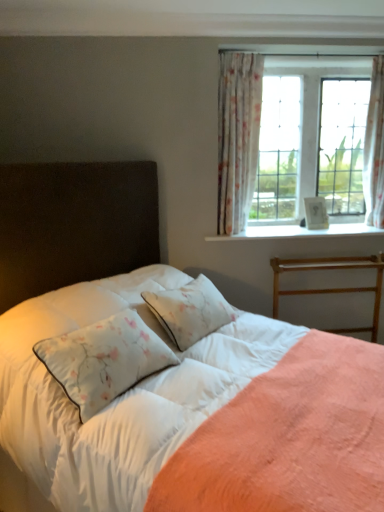
Question: Based on their sizes in the image, would you say white textured wood at upper right is bigger or smaller than floral sheer curtain at upper right, which appears as the first curtain when viewed from the left?

Choices:
 (A) big
 (B) small

Answer: (B)

Question: Based on their positions, is white textured wood at upper right located to the left or right of floral sheer curtain at upper right, which appears as the first curtain when viewed from the left?

Choices:
 (A) right
 (B) left

Answer: (A)

Question: Which object is positioned farthest from the white soft bed at center?

Choices:
 (A) white textured wood at upper right
 (B) floral sheer curtain at upper right, marked as the 2th curtain in a right-to-left arrangement
 (C) white floral fabric curtain at upper right, acting as the first curtain starting from the right
 (D) white satin sheet at center
 (E) wooden bed frame at right

Answer: (C)

Question: Which of these objects is positioned farthest from the wooden bed frame at right?

Choices:
 (A) white textured wood at upper right
 (B) floral sheer curtain at upper right, which appears as the first curtain when viewed from the left
 (C) white soft bed at center
 (D) white floral fabric curtain at upper right, acting as the first curtain starting from the right
 (E) white satin sheet at center

Answer: (E)